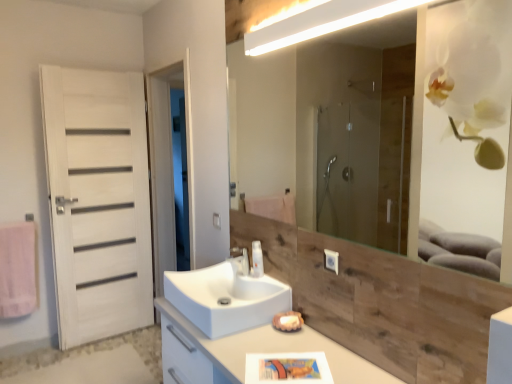
What do you see at coordinates (379, 126) in the screenshot? This screenshot has width=512, height=384. I see `wooden/matte mirror at upper center` at bounding box center [379, 126].

Image resolution: width=512 pixels, height=384 pixels. I want to click on white wood door at left, so click(98, 201).

Measure the distance between point (264, 336) and camera.

Point (264, 336) is 5.82 feet from camera.

The height and width of the screenshot is (384, 512). Describe the element at coordinates (257, 260) in the screenshot. I see `translucent plastic soap dispenser at center` at that location.

What is the approximate width of white glossy tap at center?

The width of white glossy tap at center is 6.28 inches.

Locate an element on the screen. Image resolution: width=512 pixels, height=384 pixels. white glossy sink at center is located at coordinates pyautogui.click(x=226, y=297).

Looking at this image, can you confirm if white wood door at left is positioned to the left of white glossy tap at center?

Indeed, white wood door at left is positioned on the left side of white glossy tap at center.

Can you confirm if white wood door at left is taller than white glossy tap at center?

Yes, white wood door at left is taller than white glossy tap at center.

Is point (140, 75) positioned in front of point (246, 257)?

No, it is not.

Is white glossy cabinet at center not inside white wood door at left?

Indeed, white glossy cabinet at center is completely outside white wood door at left.

Considering the positions of objects white glossy cabinet at center and white wood door at left in the image provided, who is more to the left, white glossy cabinet at center or white wood door at left?

white wood door at left is more to the left.

Which is nearer, (340, 368) or (92, 108)?

Positioned in front is point (340, 368).

Locate an element on the screen. Image resolution: width=512 pixels, height=384 pixels. light fixture on the right of white glossy tap at center is located at coordinates (321, 22).

From the picture: Is white glossy tap at center in contact with white glossy light fixture at upper center?

No, white glossy tap at center is not making contact with white glossy light fixture at upper center.

Is white glossy tap at center thinner than white glossy light fixture at upper center?

No.

Would you say white glossy tap at center is outside white glossy light fixture at upper center?

Yes.

What's the angular difference between white glossy sink at center and white wood door at left's facing directions?

There is a 92.8-degree angle between the facing directions of white glossy sink at center and white wood door at left.

Is white glossy sink at center to the left or to the right of white wood door at left in the image?

Clearly, white glossy sink at center is on the right of white wood door at left in the image.

Considering the positions of objects white glossy sink at center and white wood door at left in the image provided, who is in front, white glossy sink at center or white wood door at left?

Positioned in front is white glossy sink at center.

Is white glossy sink at center far from white wood door at left?

That's right, there is a large distance between white glossy sink at center and white wood door at left.

Which of these two, white glossy sink at center or white glossy cabinet at center, is wider?

Wider between the two is white glossy cabinet at center.

Is white glossy sink at center next to white glossy cabinet at center?

There is a gap between white glossy sink at center and white glossy cabinet at center.

Can you tell me how much white glossy sink at center and white glossy cabinet at center differ in facing direction?

0.00134 degrees.

Considering the relative sizes of white glossy sink at center and white glossy cabinet at center in the image provided, is white glossy sink at center taller than white glossy cabinet at center?

No, white glossy sink at center is not taller than white glossy cabinet at center.

From the picture: Would you say white glossy sink at center is to the left or to the right of wooden/matte mirror at upper center in the picture?

white glossy sink at center is positioned on wooden/matte mirror at upper center's left side.

Considering the sizes of objects white glossy sink at center and wooden/matte mirror at upper center in the image provided, who is taller, white glossy sink at center or wooden/matte mirror at upper center?

With more height is wooden/matte mirror at upper center.

From a real-world perspective, is white glossy sink at center positioned above or below wooden/matte mirror at upper center?

From a real-world perspective, white glossy sink at center is physically below wooden/matte mirror at upper center.

What's the angular difference between white glossy sink at center and wooden/matte mirror at upper center's facing directions?

0.0625 degrees separate the facing orientations of white glossy sink at center and wooden/matte mirror at upper center.

From a real-world perspective, is white glossy cabinet at center beneath white glossy sink at center?

Yes, from a real-world perspective, white glossy cabinet at center is under white glossy sink at center.

In the image, is white glossy cabinet at center positioned in front of or behind white glossy sink at center?

In the image, white glossy cabinet at center appears in front of white glossy sink at center.

Considering the positions of point (254, 337) and point (265, 312), is point (254, 337) closer or farther from the camera than point (265, 312)?

Point (254, 337) appears to be closer to the viewer than point (265, 312).

In terms of size, does white glossy cabinet at center appear bigger or smaller than white glossy sink at center?

Clearly, white glossy cabinet at center is larger in size than white glossy sink at center.

Locate an element on the screen. tap below the white wood door at left (from a real-world perspective) is located at coordinates (243, 258).

Find the location of `door behind the white glossy cabinet at center`. door behind the white glossy cabinet at center is located at coordinates (98, 201).

When comparing their distances from wooden/matte mirror at upper center, does white matte door at left or pink fabric towel at left seem further?

Based on the image, pink fabric towel at left appears to be further to wooden/matte mirror at upper center.

Based on their spatial positions, is white glossy cabinet at center or wooden/matte mirror at upper center closer to white wood door at left?

white glossy cabinet at center.

Considering their positions, is white wood door at left positioned further to white glossy sink at center than white glossy light fixture at upper center?

white wood door at left is further to white glossy sink at center.

Looking at the image, which one is located further to white glossy cabinet at center, white glossy tap at center or translucent plastic soap dispenser at center?

Based on the image, white glossy tap at center appears to be further to white glossy cabinet at center.

When comparing their distances from pink fabric towel at left, does white glossy cabinet at center or white glossy tap at center seem further?

Among the two, white glossy tap at center is located further to pink fabric towel at left.

In the scene shown: Considering their positions, is white matte door at left positioned further to white glossy sink at center than white glossy cabinet at center?

Among the two, white matte door at left is located further to white glossy sink at center.

When comparing their distances from wooden/matte mirror at upper center, does pink fabric towel at left or white glossy sink at center seem further?

Based on the image, pink fabric towel at left appears to be further to wooden/matte mirror at upper center.

Looking at the image, which one is located closer to white wood door at left, pink fabric towel at left or white matte door at left?

Based on the image, white matte door at left appears to be nearer to white wood door at left.

The width and height of the screenshot is (512, 384). I want to click on sink between white glossy cabinet at center and white matte door at left from front to back, so [226, 297].

In order to click on tap located between white glossy sink at center and white matte door at left in the depth direction in this screenshot , I will do `click(243, 258)`.

You are a GUI agent. You are given a task and a screenshot of the screen. Output one action in this format:
    pyautogui.click(x=<x>, y=<y>)
    Task: Click on the tap positioned between white glossy sink at center and translucent plastic soap dispenser at center from near to far
    The width and height of the screenshot is (512, 384).
    Given the screenshot: What is the action you would take?
    pyautogui.click(x=243, y=258)

What are the coordinates of `screen door between white glossy cabinet at center and white wood door at left in the front-back direction` in the screenshot? It's located at (163, 160).